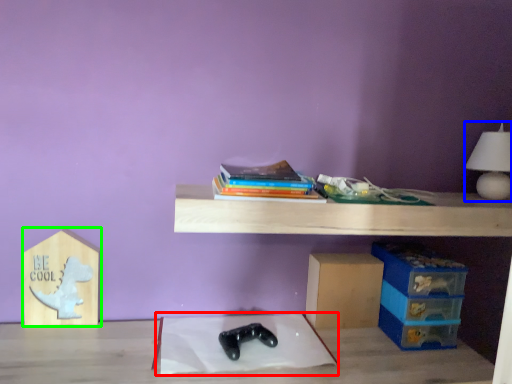
Question: Based on their relative distances, which object is nearer to sheet (highlighted by a red box)? Choose from table lamp (highlighted by a blue box) and cardboard box (highlighted by a green box).

Choices:
 (A) table lamp
 (B) cardboard box

Answer: (B)